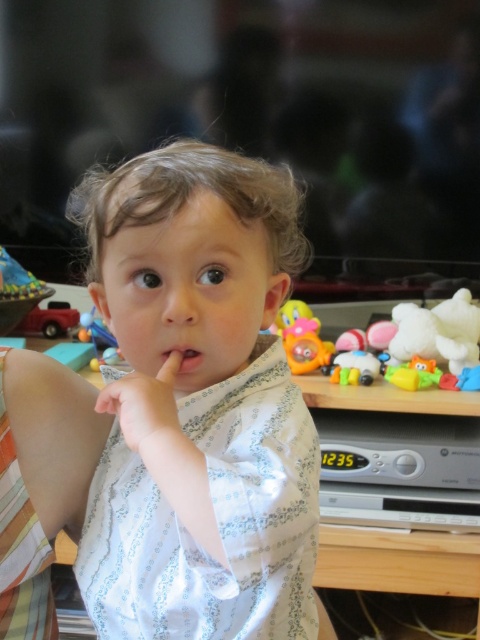
Which is above, plastic yellow duckling at right or pink matte flesh at center?

pink matte flesh at center is above.

Identify the location of plastic yellow duckling at right. Image resolution: width=480 pixels, height=640 pixels. (391, 340).

This screenshot has height=640, width=480. I want to click on plastic yellow duckling at right, so click(391, 340).

Between white printed shirt at center and pink matte flesh at center, which one appears on the left side from the viewer's perspective?

From the viewer's perspective, pink matte flesh at center appears more on the left side.

Which of these two, white printed shirt at center or pink matte flesh at center, stands taller?

Standing taller between the two is white printed shirt at center.

Where is `white printed shirt at center`? The image size is (480, 640). white printed shirt at center is located at coordinates (199, 403).

The width and height of the screenshot is (480, 640). I want to click on white printed shirt at center, so click(x=199, y=403).

Can you confirm if white printed shirt at center is thinner than plastic yellow duckling at right?

Correct, white printed shirt at center's width is less than plastic yellow duckling at right's.

Is point (215, 342) positioned before point (435, 326)?

Yes, point (215, 342) is in front of point (435, 326).

Is point (157, 348) in front of point (456, 353)?

Yes.

Identify the location of white printed shirt at center. The height and width of the screenshot is (640, 480). (x=199, y=403).